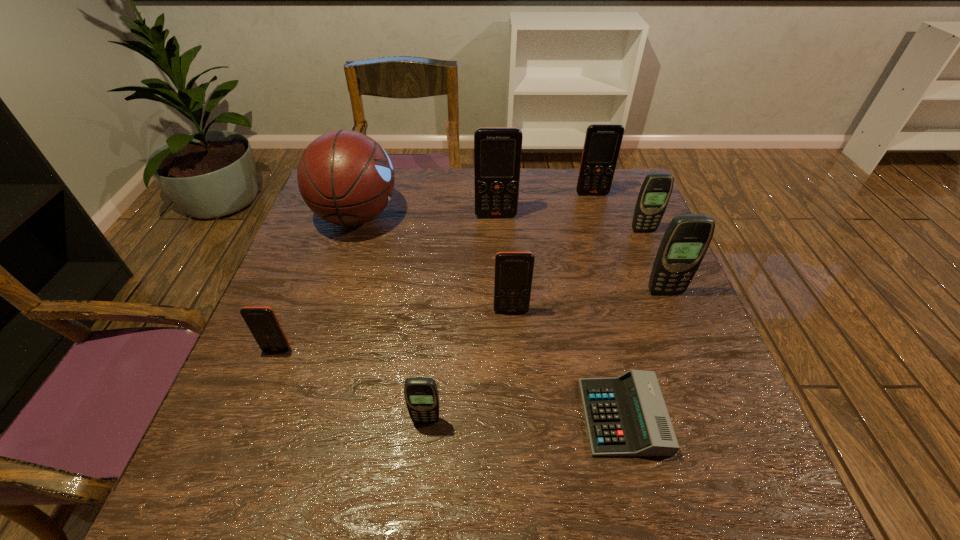
Locate an element on the screen. The width and height of the screenshot is (960, 540). the second smallest orange cellular telephone is located at coordinates (513, 277).

Image resolution: width=960 pixels, height=540 pixels. I want to click on the nearest orange cellular telephone, so click(x=262, y=322).

This screenshot has width=960, height=540. In order to click on the third nearest object in this screenshot , I will do `click(262, 322)`.

Locate an element on the screen. The height and width of the screenshot is (540, 960). the seventh object from right to left is located at coordinates (421, 395).

You are a GUI agent. You are given a task and a screenshot of the screen. Output one action in this format:
    pyautogui.click(x=<x>, y=<y>)
    Task: Click on the leftmost gray cellular telephone
    This screenshot has width=960, height=540.
    Given the screenshot: What is the action you would take?
    pyautogui.click(x=421, y=395)

Identify the location of the shortest object. Image resolution: width=960 pixels, height=540 pixels. (626, 415).

Find the location of `gray calculator`. gray calculator is located at coordinates (626, 415).

At what (x,y) coordinates should I click in order to perform the action: click on vacant space located on the screen of the second farthest cellular telephone. Please return your answer as a coordinate pair (x, y). Looking at the image, I should click on (500, 313).

Locate an element on the screen. This screenshot has width=960, height=540. vacant space located on the right of the basketball is located at coordinates point(462,216).

Image resolution: width=960 pixels, height=540 pixels. I want to click on free space located on the screen of the fifth cellular telephone from left to right, so click(598, 212).